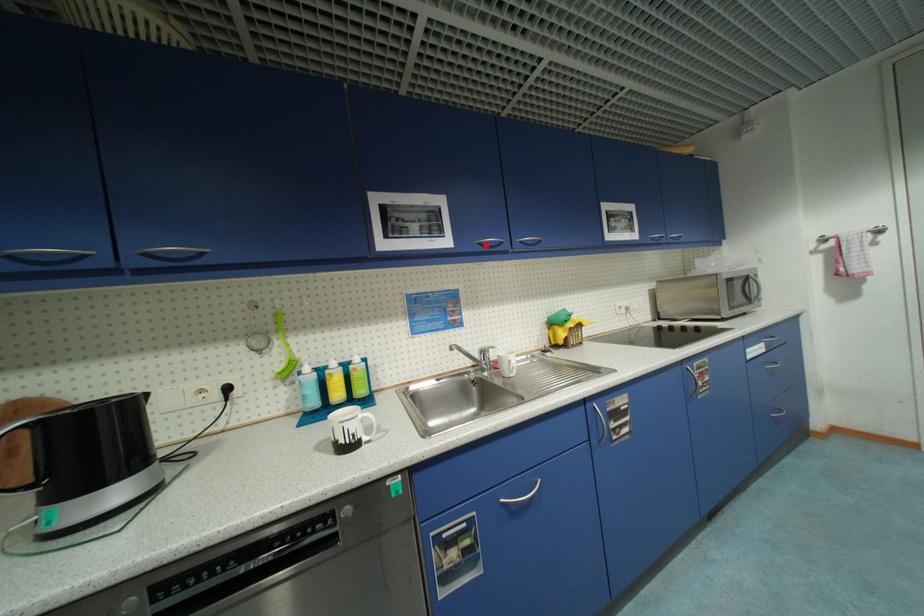
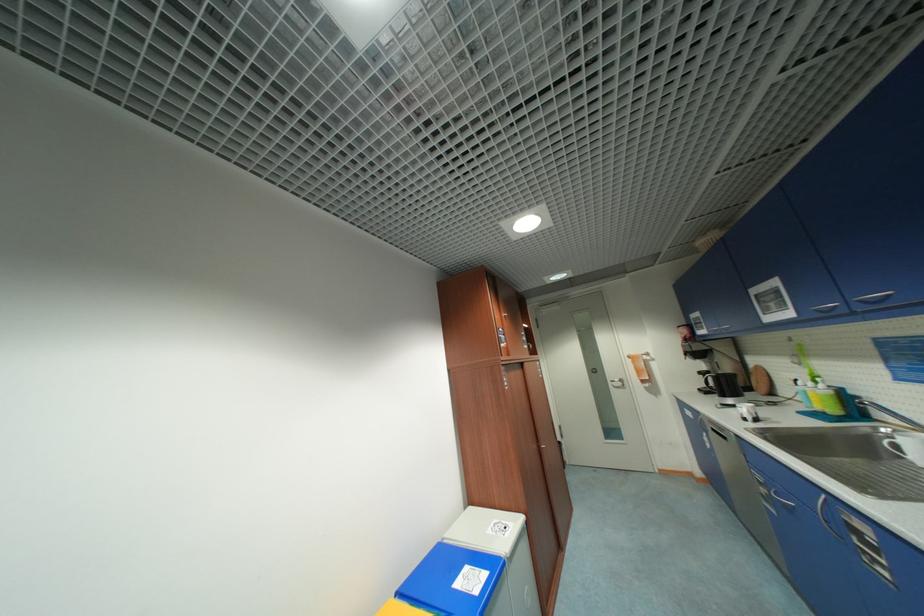
Find the pixel in the second image that matches the highlighted location in the first image.

(822, 312)